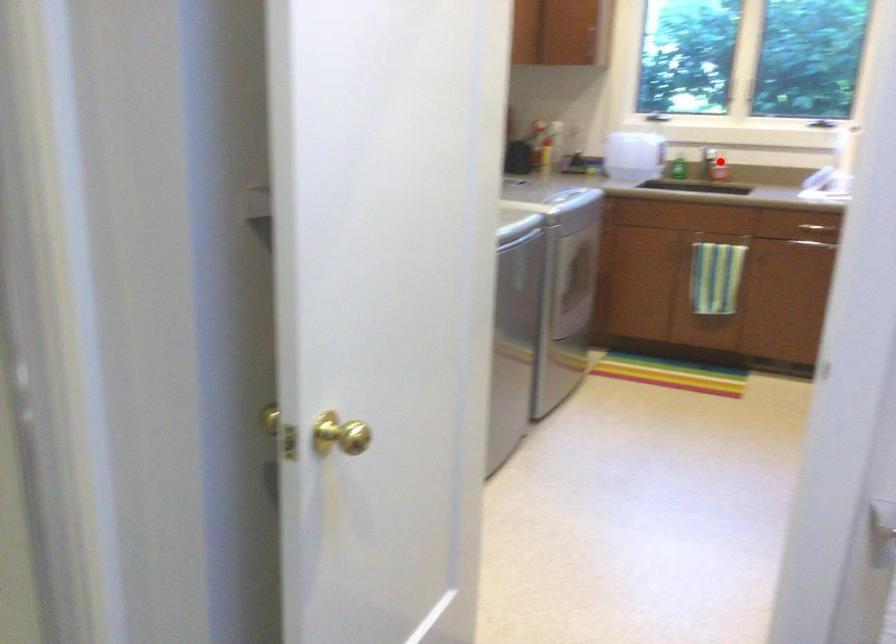
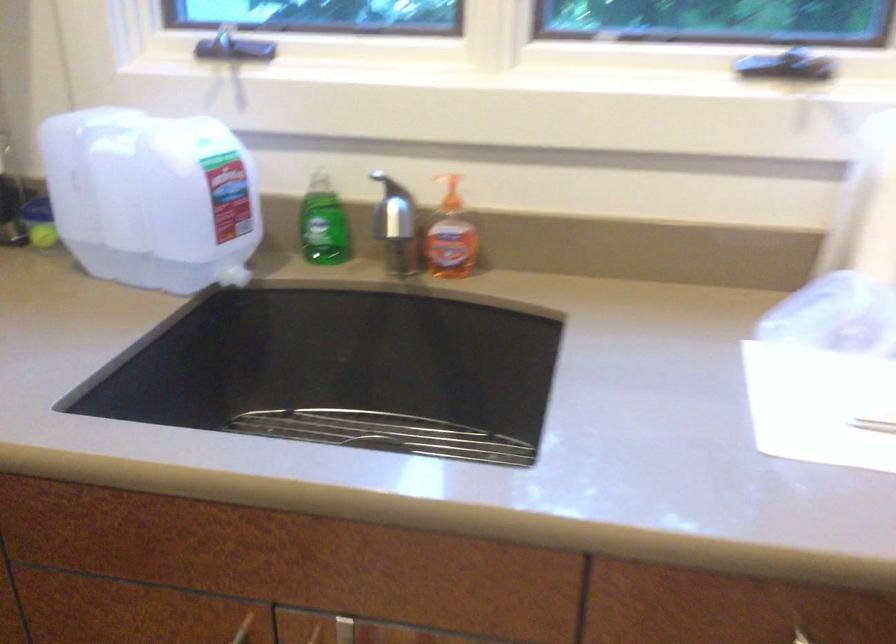
Locate, in the second image, the point that corresponds to the highlighted location in the first image.

(451, 236)